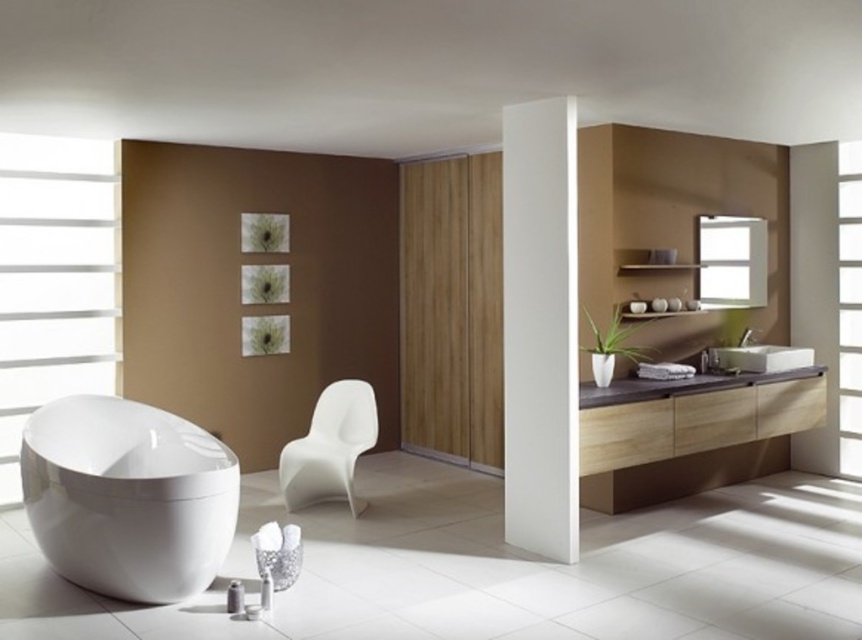
Does light wood vanity at right have a greater height compared to transparent glass window at upper right?

Incorrect, light wood vanity at right's height is not larger of transparent glass window at upper right's.

Which is above, light wood vanity at right or transparent glass window at upper right?

transparent glass window at upper right

Between point (809, 410) and point (713, 227), which one is positioned behind?

Point (713, 227)

The height and width of the screenshot is (640, 862). I want to click on light wood vanity at right, so click(x=692, y=440).

Can you confirm if white matte window at left is shorter than white glossy sink at right?

No.

Does point (86, 157) come farther from viewer compared to point (742, 346)?

No, it is in front of (742, 346).

I want to click on white matte window at left, so click(x=54, y=280).

Can you confirm if light wood vanity at right is positioned to the right of white matte chair at center?

Correct, you'll find light wood vanity at right to the right of white matte chair at center.

Locate an element on the screen. light wood vanity at right is located at coordinates (692, 440).

I want to click on light wood vanity at right, so click(692, 440).